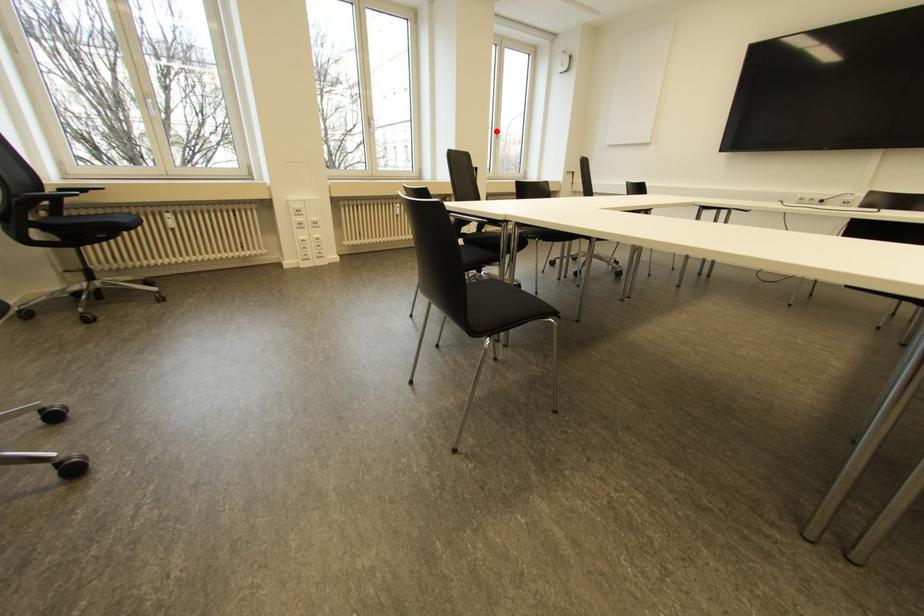
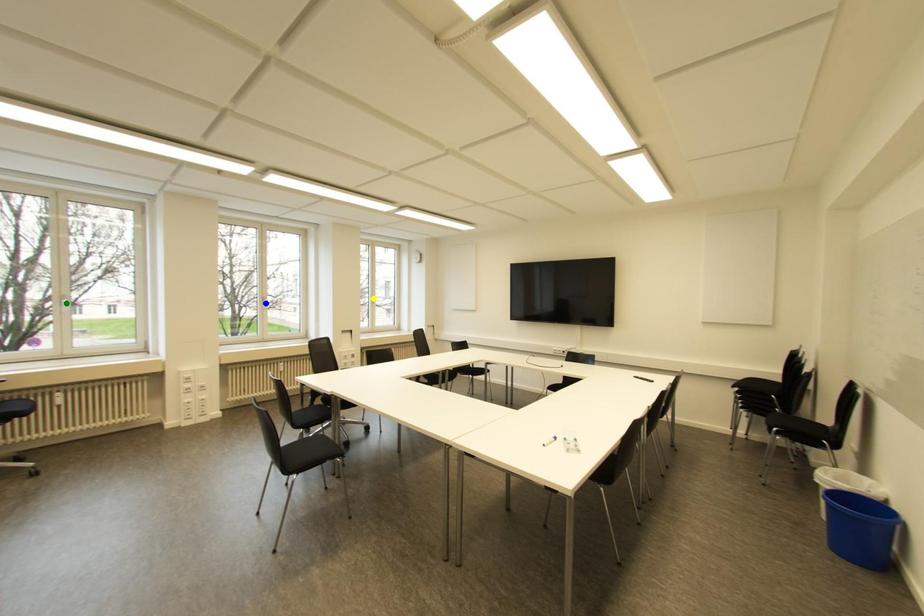
Question: I am providing you with two images of the same scene from different viewpoints. A red point is marked on the first image. You are given multiple points on the second image. Which point in image 2 represents the same 3d spot as the red point in image 1?

Choices:
 (A) green point
 (B) yellow point
 (C) blue point

Answer: (B)